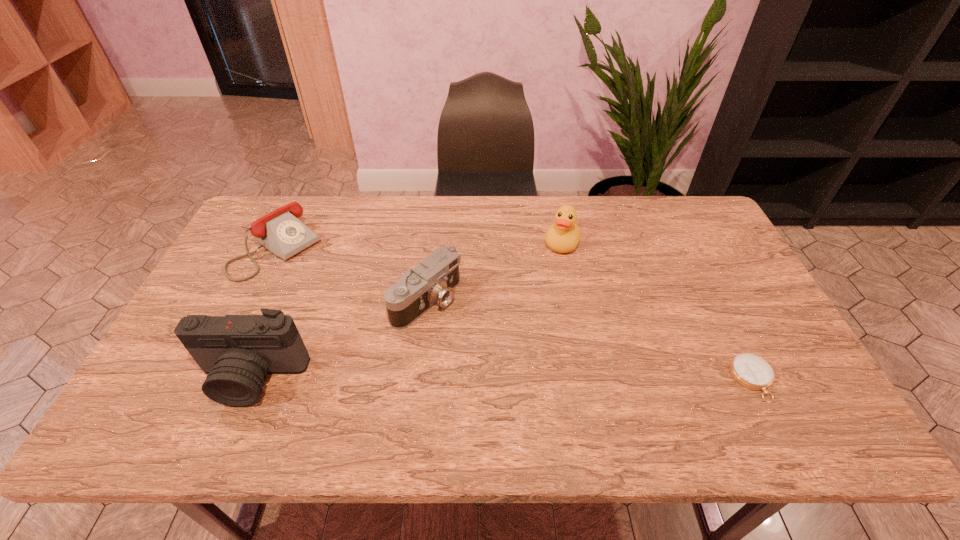
Where is `camera at the near edge`? camera at the near edge is located at coordinates (237, 352).

Image resolution: width=960 pixels, height=540 pixels. I want to click on compass that is at the near edge, so click(749, 370).

Where is `camera located at the left edge`? The height and width of the screenshot is (540, 960). camera located at the left edge is located at coordinates (237, 352).

Identify the location of telephone that is at the left edge. The width and height of the screenshot is (960, 540). (281, 232).

You are a GUI agent. You are given a task and a screenshot of the screen. Output one action in this format:
    pyautogui.click(x=<x>, y=<y>)
    Task: Click on the object situated at the right edge
    The width and height of the screenshot is (960, 540).
    Given the screenshot: What is the action you would take?
    pyautogui.click(x=749, y=370)

Image resolution: width=960 pixels, height=540 pixels. In order to click on object that is at the far left corner in this screenshot , I will do `click(281, 232)`.

Identify the location of object that is at the near left corner. The width and height of the screenshot is (960, 540). [237, 352].

In order to click on object at the near right corner in this screenshot , I will do `click(749, 370)`.

Image resolution: width=960 pixels, height=540 pixels. Identify the location of vacant space at the far edge of the desktop. (390, 222).

In the image, there is a desktop. What are the coordinates of `free region at the near edge` in the screenshot? It's located at (489, 395).